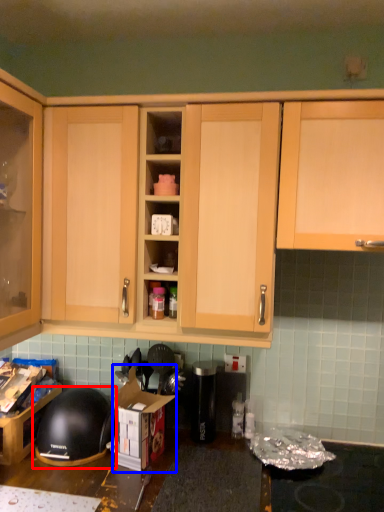
Question: Which point is closer to the camera, helmet (highlighted by a red box) or cardboard box (highlighted by a blue box)?

Choices:
 (A) helmet
 (B) cardboard box

Answer: (B)